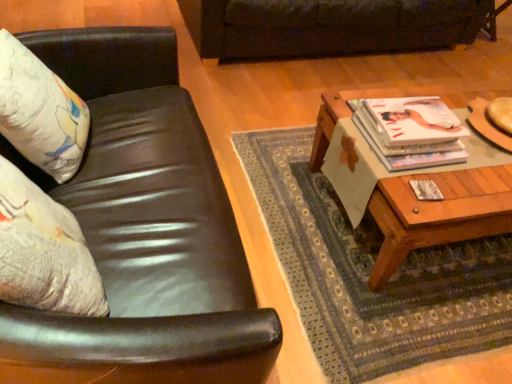
This screenshot has height=384, width=512. I want to click on free space to the right of white glossy magazine at upper right, so click(x=481, y=168).